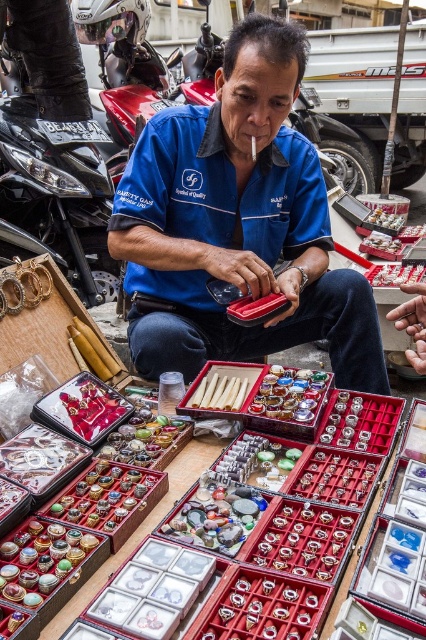
What are the coordinates of the blue fabric shirt at center?

The blue fabric shirt at center is located at point (238, 225).

You are standing in front of the street vendor and want to pick up an item from the point marked as point (305, 285). Considering your arm length is 2.5 feet, can you reach it without moving closer?

The distance between you and point (305, 285) is 6.82 feet, which is greater than your arm length of 2.5 feet. Therefore, you cannot reach it without moving closer.